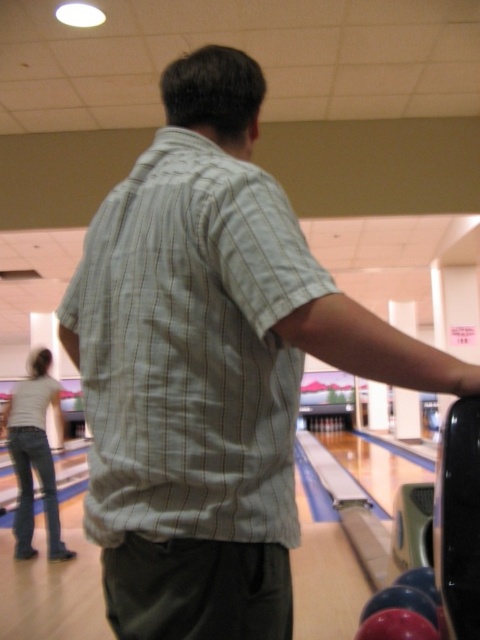
Question: Does light green striped shirt at center appear on the left side of white cotton shirt at lower left?

Choices:
 (A) no
 (B) yes

Answer: (A)

Question: Which of the following is the farthest from the observer?

Choices:
 (A) light green striped shirt at center
 (B) white cotton shirt at lower left

Answer: (B)

Question: Does light green striped shirt at center have a larger size compared to white cotton shirt at lower left?

Choices:
 (A) no
 (B) yes

Answer: (A)

Question: Can you confirm if light green striped shirt at center is bigger than white cotton shirt at lower left?

Choices:
 (A) yes
 (B) no

Answer: (B)

Question: Among these objects, which one is nearest to the camera?

Choices:
 (A) light green striped shirt at center
 (B) white cotton shirt at lower left

Answer: (A)